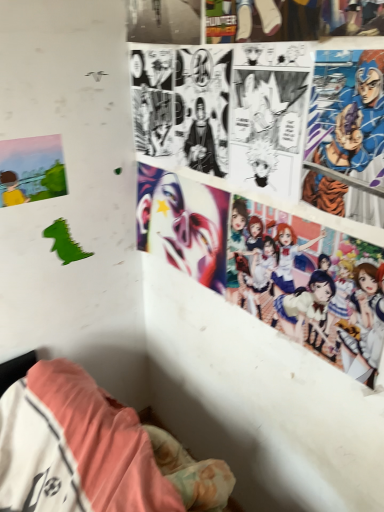
Question: In the image, is blue metallic armor at upper right, marked as the second person in a bottom-to-top arrangement, positioned in front of or behind colorful anime characters at upper right, which is the first person in bottom-to-top order?

Choices:
 (A) front
 (B) behind

Answer: (A)

Question: Is blue metallic armor at upper right, marked as the second person in a bottom-to-top arrangement, situated inside colorful anime characters at upper right, which is counted as the 2th person, starting from the top, or outside?

Choices:
 (A) inside
 (B) outside

Answer: (B)

Question: Which of these objects is positioned closest to the blue metallic armor at upper right, acting as the 1th person starting from the top?

Choices:
 (A) colorful anime characters at upper right, which is the first person in bottom-to-top order
 (B) shiny metallic mask at center
 (C) matte paper poster at left

Answer: (A)

Question: Estimate the real-world distances between objects in this image. Which object is farther from the blue metallic armor at upper right, marked as the second person in a bottom-to-top arrangement?

Choices:
 (A) colorful anime characters at upper right, which is counted as the 2th person, starting from the top
 (B) matte paper poster at left
 (C) shiny metallic mask at center

Answer: (B)